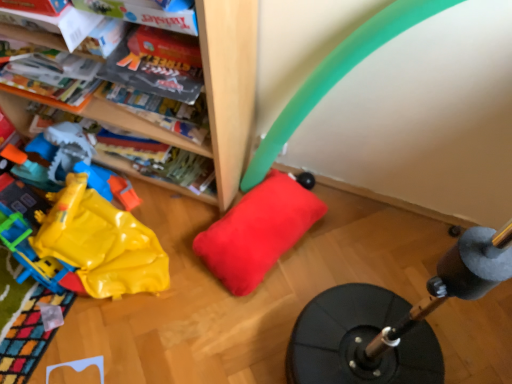
Describe the element at coordinates (87, 245) in the screenshot. The width and height of the screenshot is (512, 384). I see `rubber/yellow at left` at that location.

Measure the distance between point (106, 222) and camera.

The depth of point (106, 222) is 1.34 meters.

I want to click on rubber/yellow at left, so click(87, 245).

You are a GUI agent. You are given a task and a screenshot of the screen. Output one action in this format:
    pyautogui.click(x=<x>, y=<y>)
    Task: Click on the red plush pillow at center
    The height and width of the screenshot is (384, 512).
    Given the screenshot: What is the action you would take?
    pyautogui.click(x=259, y=230)

The width and height of the screenshot is (512, 384). Describe the element at coordinates (259, 230) in the screenshot. I see `red plush pillow at center` at that location.

Identify the location of rubber/yellow at left. The image size is (512, 384). coord(87,245).

Is red plush pillow at center to the left or to the right of rubber/yellow at left in the image?

Clearly, red plush pillow at center is on the right of rubber/yellow at left in the image.

Between red plush pillow at center and rubber/yellow at left, which one is positioned in front?

Positioned in front is rubber/yellow at left.

Which is more distant, (212,230) or (93,226)?

Positioned behind is point (212,230).

From the image's perspective, is red plush pillow at center on top of rubber/yellow at left?

No, from the image's perspective, red plush pillow at center is not over rubber/yellow at left.

From a real-world perspective, is red plush pillow at center located beneath rubber/yellow at left?

Yes, from a real-world perspective, red plush pillow at center is under rubber/yellow at left.

In the scene shown: Can you confirm if red plush pillow at center is thinner than rubber/yellow at left?

Indeed, red plush pillow at center has a lesser width compared to rubber/yellow at left.

In terms of height, does red plush pillow at center look taller or shorter compared to rubber/yellow at left?

Clearly, red plush pillow at center is shorter compared to rubber/yellow at left.

Which of these two, red plush pillow at center or rubber/yellow at left, is bigger?

rubber/yellow at left.

From the picture: Does red plush pillow at center contain rubber/yellow at left?

No.

Would you consider red plush pillow at center to be distant from rubber/yellow at left?

That's not correct — red plush pillow at center is a little close to rubber/yellow at left.

Is rubber/yellow at left at the back of red plush pillow at center?

No, red plush pillow at center is not facing away from rubber/yellow at left.

Find the location of a particular element. The width and height of the screenshot is (512, 384). toy on the left of red plush pillow at center is located at coordinates (87, 245).

Which object is positioned more to the right, rubber/yellow at left or red plush pillow at center?

red plush pillow at center.

Which is behind, rubber/yellow at left or red plush pillow at center?

red plush pillow at center is behind.

Which is nearer, (64, 283) or (287, 245)?

Point (64, 283).

From the image's perspective, is rubber/yellow at left located above or below red plush pillow at center?

From the image's perspective, rubber/yellow at left appears above red plush pillow at center.

From a real-world perspective, which is physically above, rubber/yellow at left or red plush pillow at center?

rubber/yellow at left is physically above.

Between rubber/yellow at left and red plush pillow at center, which one has smaller width?

With smaller width is red plush pillow at center.

Does rubber/yellow at left have a greater height compared to red plush pillow at center?

Yes.

Can you confirm if rubber/yellow at left is bigger than red plush pillow at center?

Indeed, rubber/yellow at left has a larger size compared to red plush pillow at center.

Choose the correct answer: Is rubber/yellow at left inside red plush pillow at center or outside it?

rubber/yellow at left is located beyond the bounds of red plush pillow at center.

Are rubber/yellow at left and red plush pillow at center making contact?

No, rubber/yellow at left is not with red plush pillow at center.

Is rubber/yellow at left oriented away from red plush pillow at center?

No, rubber/yellow at left is not facing the opposite direction of red plush pillow at center.

Identify the location of pillow on the right of rubber/yellow at left. The width and height of the screenshot is (512, 384). (259, 230).

Identify the location of pillow that appears below the rubber/yellow at left (from the image's perspective). (259, 230).

Where is `toy that appears above the red plush pillow at center (from a real-world perspective)`? toy that appears above the red plush pillow at center (from a real-world perspective) is located at coordinates (87, 245).